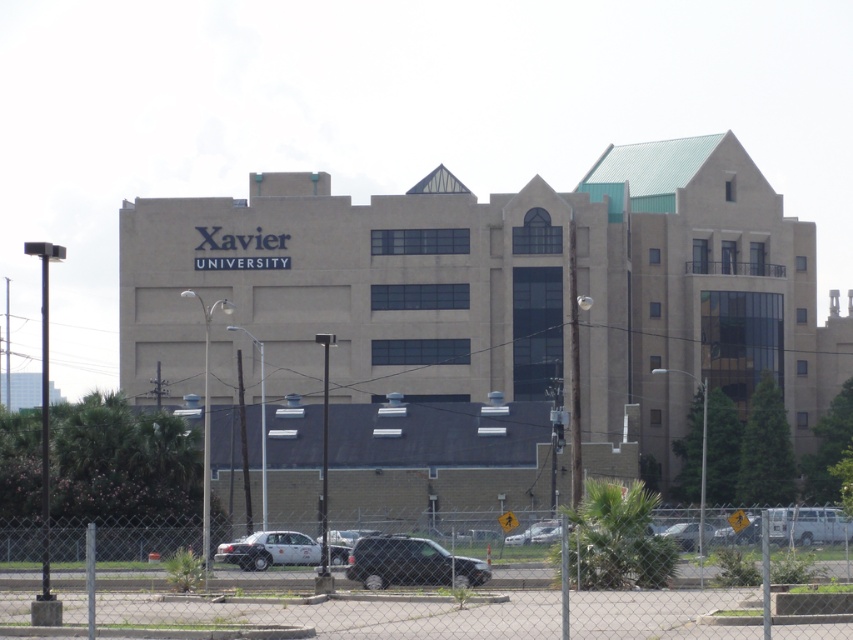
Does point (299, 547) lie in front of point (515, 536)?

No, it is behind (515, 536).

Is the position of white matte sedan at lower center more distant than that of silver metallic car at lower center?

Yes, white matte sedan at lower center is behind silver metallic car at lower center.

The image size is (853, 640). I want to click on white matte sedan at lower center, so click(270, 548).

Does shiny black suv at lower center have a lesser width compared to silver metallic car at lower center?

In fact, shiny black suv at lower center might be wider than silver metallic car at lower center.

Find the location of a particular element. Image resolution: width=853 pixels, height=640 pixels. shiny black suv at lower center is located at coordinates (410, 563).

This screenshot has width=853, height=640. What do you see at coordinates (410, 563) in the screenshot?
I see `shiny black suv at lower center` at bounding box center [410, 563].

Find the location of `shiny black suv at lower center`. shiny black suv at lower center is located at coordinates (410, 563).

Can you confirm if white matte sedan at lower center is positioned above silver metallic sedan at lower right?

No, white matte sedan at lower center is not above silver metallic sedan at lower right.

Who is taller, white matte sedan at lower center or silver metallic sedan at lower right?

Standing taller between the two is white matte sedan at lower center.

At what (x,y) coordinates should I click in order to perform the action: click on white matte sedan at lower center. Please return your answer as a coordinate pair (x, y). The width and height of the screenshot is (853, 640). Looking at the image, I should click on (270, 548).